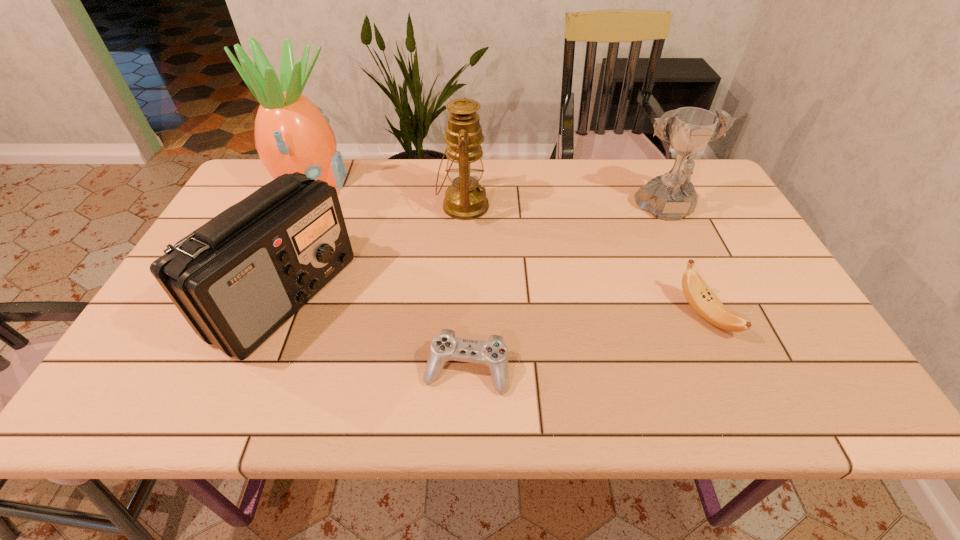
This screenshot has height=540, width=960. What are the coordinates of `free space between the pineapple and the award` in the screenshot? It's located at (489, 197).

The image size is (960, 540). I want to click on empty location between the shortest object and the radio receiver, so click(375, 333).

Locate an element on the screen. The height and width of the screenshot is (540, 960). empty space between the pineapple and the award is located at coordinates (489, 197).

This screenshot has height=540, width=960. I want to click on free space between the radio receiver and the oil lamp, so click(373, 251).

The height and width of the screenshot is (540, 960). I want to click on vacant region between the shortest object and the oil lamp, so click(x=465, y=288).

Point out which object is positioned as the third nearest to the award. Please provide its 2D coordinates. Your answer should be formatted as a tuple, i.e. [(x, y)], where the tuple contains the x and y coordinates of a point satisfying the conditions above.

[(445, 346)]

Image resolution: width=960 pixels, height=540 pixels. Find the location of `object that stands as the third closest to the control`. object that stands as the third closest to the control is located at coordinates (697, 293).

You are a GUI agent. You are given a task and a screenshot of the screen. Output one action in this format:
    pyautogui.click(x=<x>, y=<y>)
    Task: Click on the free spot that satisfies the following two spatial constraints: 1. on the front panel of the banana; 2. on the right side of the radio receiver
    
    Given the screenshot: What is the action you would take?
    pyautogui.click(x=276, y=315)